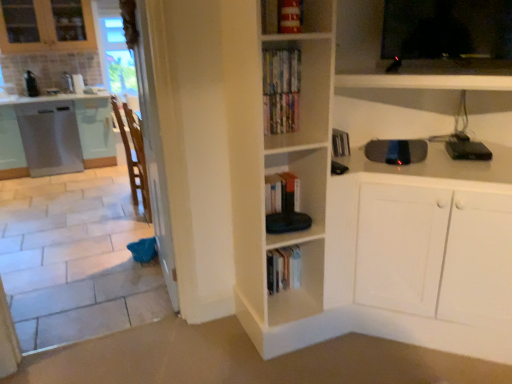
You are a GUI agent. You are given a task and a screenshot of the screen. Output one action in this format:
    pyautogui.click(x=<x>, y=<y>)
    Task: Click on the free space in front of brown wooden chair at left
    
    Given the screenshot: What is the action you would take?
    pyautogui.click(x=125, y=231)